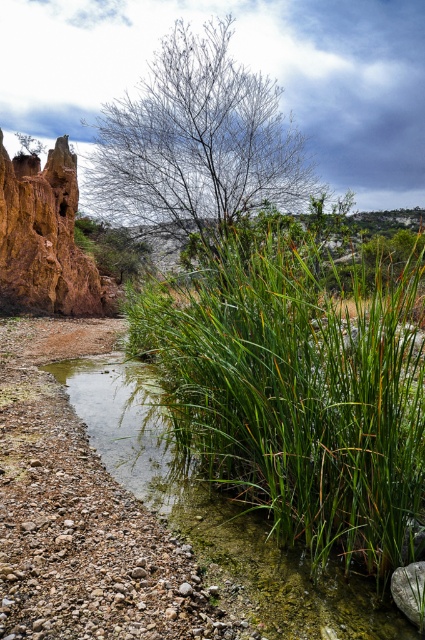
You are a hiker trying to cross the stream. You see the green leafy grass at center and the rustic clay cliff at left. Which object is closer to the stream?

The green leafy grass at center is closer to the stream because it is positioned below the rustic clay cliff at left, indicating it is lower in elevation and near the water.

You are an artist sketching the landscape and want to place the bare branches at upper center accurately. According to the coordinates provided, where should you position them on your canvas?

The bare branches at upper center should be positioned at the 2D coordinates point (197, 141) on the canvas.

You are standing at the point labeled as point (299, 387) in the image. What type of terrain are you currently standing on?

You are standing on green leafy grass at center.